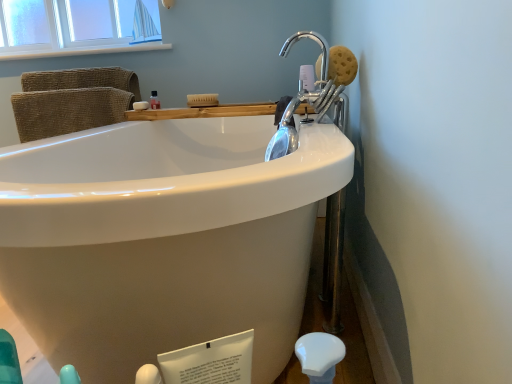
Question: Visually, is wooden tray at upper center positioned to the left or to the right of translucent plastic bottle at upper center?

Choices:
 (A) left
 (B) right

Answer: (B)

Question: Looking at their shapes, would you say wooden tray at upper center is wider or thinner than translucent plastic bottle at upper center?

Choices:
 (A) wide
 (B) thin

Answer: (A)

Question: Which is nearer to the brown sponge at upper right, the second soap positioned from the left?

Choices:
 (A) white matte soap at upper left, positioned as the second soap in front-to-back order
 (B) translucent plastic bottle at upper center
 (C) wooden tray at upper center
 (D) white wood window sill at upper left

Answer: (C)

Question: Considering the real-world distances, which object is closest to the white wood window sill at upper left?

Choices:
 (A) wooden tray at upper center
 (B) white matte soap at upper left, which is counted as the second soap, starting from the right
 (C) translucent plastic bottle at upper center
 (D) brown sponge at upper right, the 1th soap viewed from the right

Answer: (C)